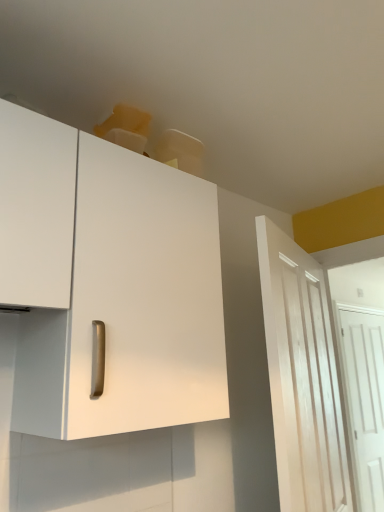
Question: Could white wood door at right, which ranks as the 1th door in left-to-right order, be considered to be inside white wooden door at right, which is the 2th door from front to back?

Choices:
 (A) no
 (B) yes

Answer: (A)

Question: Considering the relative positions of white wooden door at right, the first door from the right, and white wood door at right, which ranks as the 1th door in left-to-right order, in the image provided, is white wooden door at right, the first door from the right, to the right of white wood door at right, which ranks as the 1th door in left-to-right order, from the viewer's perspective?

Choices:
 (A) yes
 (B) no

Answer: (A)

Question: Considering the relative sizes of white wooden door at right, the first door from the right, and white wood door at right, marked as the 2th door in a right-to-left arrangement, in the image provided, is white wooden door at right, the first door from the right, bigger than white wood door at right, marked as the 2th door in a right-to-left arrangement,?

Choices:
 (A) no
 (B) yes

Answer: (A)

Question: Is the surface of white wooden door at right, the second door viewed from the left, in direct contact with white wood door at right, marked as the 2th door in a right-to-left arrangement?

Choices:
 (A) no
 (B) yes

Answer: (A)

Question: Is white wooden door at right, the first door from the right, smaller than white wood door at right, the 1th door when ordered from front to back?

Choices:
 (A) yes
 (B) no

Answer: (A)

Question: Is white wooden door at right, which is the 2th door from front to back, shorter than white wood door at right, which is counted as the 2th door, starting from the back?

Choices:
 (A) yes
 (B) no

Answer: (B)

Question: Is white wood door at right, the 1th door when ordered from front to back, positioned with its back to white matte cabinet at upper left?

Choices:
 (A) yes
 (B) no

Answer: (B)

Question: Can you confirm if white wood door at right, which is counted as the 2th door, starting from the back, is wider than white matte cabinet at upper left?

Choices:
 (A) yes
 (B) no

Answer: (B)

Question: Can you confirm if white wood door at right, which ranks as the 1th door in left-to-right order, is positioned to the left of white matte cabinet at upper left?

Choices:
 (A) no
 (B) yes

Answer: (A)

Question: Would you say white wood door at right, which is counted as the 2th door, starting from the back, is outside white matte cabinet at upper left?

Choices:
 (A) yes
 (B) no

Answer: (A)

Question: Does white wood door at right, which ranks as the 1th door in left-to-right order, come in front of white matte cabinet at upper left?

Choices:
 (A) no
 (B) yes

Answer: (A)

Question: Is the position of white wood door at right, marked as the 2th door in a right-to-left arrangement, more distant than that of white matte cabinet at upper left?

Choices:
 (A) no
 (B) yes

Answer: (B)

Question: Is white matte cabinet at upper left at the left side of white wooden door at right, which is counted as the 1th door, starting from the back?

Choices:
 (A) no
 (B) yes

Answer: (B)